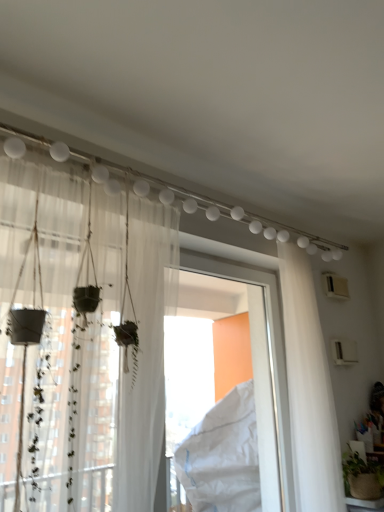
Question: Can white plastic window frame at center be found inside white sheer curtain at right, the 1th curtain viewed from the back?

Choices:
 (A) no
 (B) yes

Answer: (A)

Question: Does white sheer curtain at right, the second curtain in the left-to-right sequence, have a greater width compared to white plastic window frame at center?

Choices:
 (A) no
 (B) yes

Answer: (B)

Question: Can you confirm if white sheer curtain at right, the second curtain in the left-to-right sequence, is thinner than white plastic window frame at center?

Choices:
 (A) yes
 (B) no

Answer: (B)

Question: Is white sheer curtain at right, the second curtain viewed from the front, smaller than white plastic window frame at center?

Choices:
 (A) no
 (B) yes

Answer: (B)

Question: Is there a large distance between white sheer curtain at right, the second curtain in the left-to-right sequence, and white plastic window frame at center?

Choices:
 (A) yes
 (B) no

Answer: (B)

Question: Is the depth of white sheer curtain at right, the second curtain viewed from the front, greater than that of white plastic window frame at center?

Choices:
 (A) no
 (B) yes

Answer: (B)

Question: Is white plastic window frame at center completely or partially inside sheer white curtain at left, the second curtain when ordered from right to left?

Choices:
 (A) no
 (B) yes

Answer: (A)

Question: Is sheer white curtain at left, the 1th curtain viewed from the left, thinner than white plastic window frame at center?

Choices:
 (A) yes
 (B) no

Answer: (B)

Question: From the image's perspective, is sheer white curtain at left, the 1th curtain viewed from the left, below white plastic window frame at center?

Choices:
 (A) no
 (B) yes

Answer: (A)

Question: Is sheer white curtain at left, the 1th curtain viewed from the left, far away from white plastic window frame at center?

Choices:
 (A) yes
 (B) no

Answer: (B)

Question: Is sheer white curtain at left, the 2th curtain from the back, placed right next to white plastic window frame at center?

Choices:
 (A) no
 (B) yes

Answer: (A)

Question: Does sheer white curtain at left, the 2th curtain from the back, have a lesser height compared to white plastic window frame at center?

Choices:
 (A) yes
 (B) no

Answer: (A)

Question: Can you confirm if white plastic window frame at center is taller than white sheer curtain at right, the second curtain viewed from the front?

Choices:
 (A) yes
 (B) no

Answer: (B)